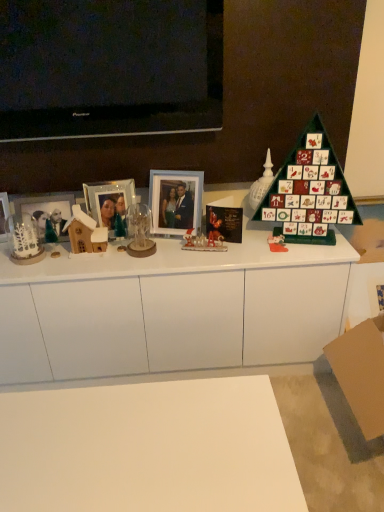
Where is `free space in front of black paper christmas card at center`? The height and width of the screenshot is (512, 384). free space in front of black paper christmas card at center is located at coordinates (230, 251).